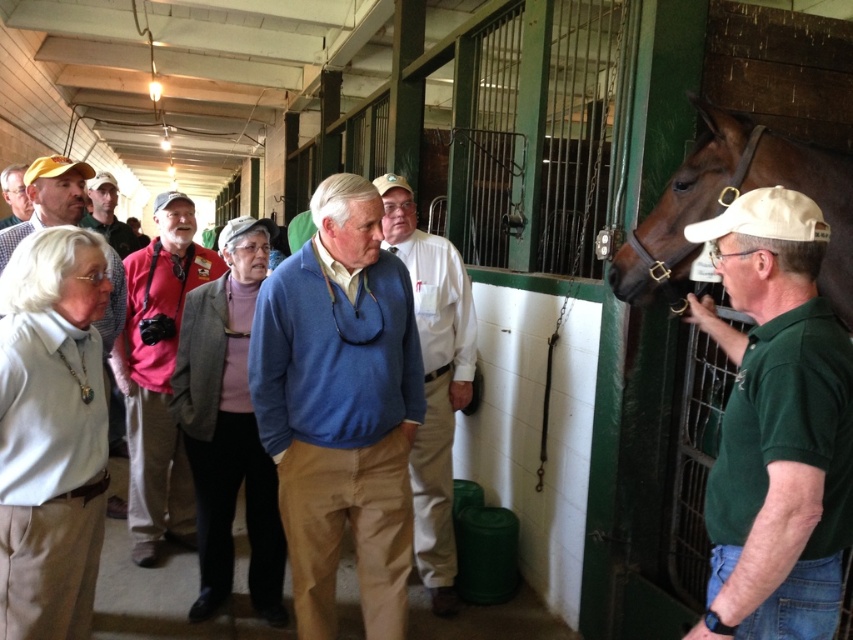
You are standing in the stable and want to take a photo of the white matte shirt at center without getting too close. If your camera has a maximum focus range of 6 feet, will you be able to capture a clear photo from your current position?

The white matte shirt at center and viewer are 5.91 feet apart from each other. Since the distance is within the camera maximum focus range of 6 feet, you can capture a clear photo without moving closer.

You are standing in the stable and want to take a photo of two specific points marked in the image. The first point is at coordinate point (724,340) and the second is at point (158,262). If you have a camera with a fixed focal length and you want to ensure both points are in focus, which point should you focus on to maximize the depth of field?

You should focus on point (158,262) because it is farther from the camera than point (724,340). By focusing on the farther point, the depth of field will extend backward to include the closer point as well, ensuring both are in focus.